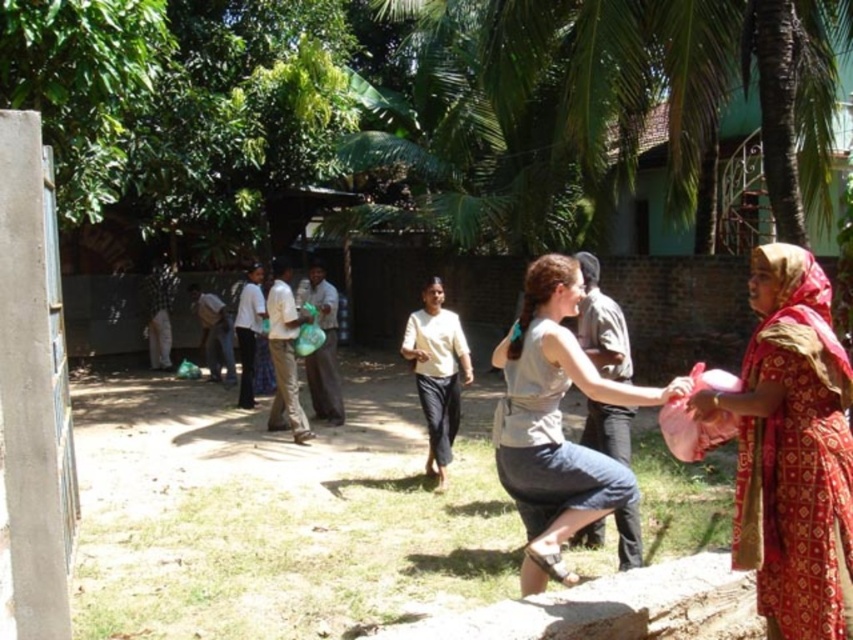
In the scene shown: You are standing at the center of the scene and want to hand a gift to the person wearing the red printed sari at right. In which direction should you move to reach their location?

The red printed sari at right is located at point 0.705 on the x axis and 0.930 on the y axis. Since you are at the center, you should move towards the right and slightly upwards to reach their location.

You are standing in the scene and want to place a small marker at the point labeled as point (792,451). Where should you place it?

The point (792,451) is on the red printed sari at right, so place the marker there.

You are a photographer at the event and want to capture both the red printed sari at right and the matte gray dress at center in a single shot. Based on their positions, which one should you focus on first to ensure both are in frame?

Since the red printed sari at right is located above the matte gray dress at center, you should focus on the matte gray dress at center first to ensure both are within the camera frame.